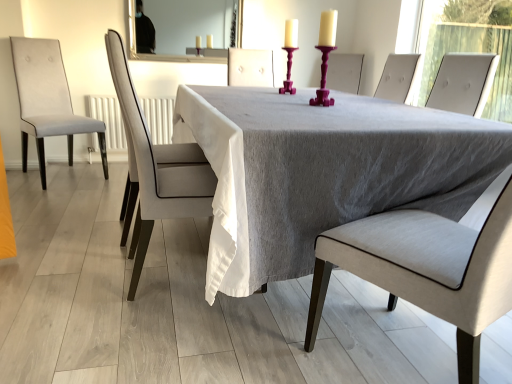
In order to face white glossy mirror at upper center, should I rotate leftwards or rightwards?

A 9.399 degree turn to the left will do.

Locate an element on the screen. The height and width of the screenshot is (384, 512). purple glossy candle holder at center, marked as the 2th candle holder in a front-to-back arrangement is located at coordinates (290, 53).

Which is behind, point (222, 44) or point (329, 27)?

The point (222, 44) is farther from the camera.

From the image's perspective, is white glossy mirror at upper center above or below purple plastic candle holder at center, the first candle holder in the front-to-back sequence?

Clearly, from the image's perspective, white glossy mirror at upper center is above purple plastic candle holder at center, the first candle holder in the front-to-back sequence.

Is white glossy mirror at upper center next to purple plastic candle holder at center, the first candle holder in the front-to-back sequence, and touching it?

No.

Which of these two, white glossy mirror at upper center or purple plastic candle holder at center, the first candle holder in the front-to-back sequence, stands shorter?

purple plastic candle holder at center, the first candle holder in the front-to-back sequence.

Consider the image. Between purple glossy candle holder at center, marked as the 2th candle holder in a front-to-back arrangement, and white glossy mirror at upper center, which one has more height?

white glossy mirror at upper center is taller.

Is purple glossy candle holder at center, the 1th candle holder positioned from the back, placed right next to white glossy mirror at upper center?

No, purple glossy candle holder at center, the 1th candle holder positioned from the back, is not touching white glossy mirror at upper center.

Choose the correct answer: Is purple glossy candle holder at center, the 1th candle holder positioned from the back, inside white glossy mirror at upper center or outside it?

purple glossy candle holder at center, the 1th candle holder positioned from the back, is not enclosed by white glossy mirror at upper center.

Is light gray fabric chair at center, which ranks as the first chair in front-to-back order, located outside purple plastic candle holder at center, the first candle holder in the front-to-back sequence?

Yes, light gray fabric chair at center, which ranks as the first chair in front-to-back order, is not within purple plastic candle holder at center, the first candle holder in the front-to-back sequence.

What's the angular difference between light gray fabric chair at center, the third chair in the back-to-front sequence, and purple plastic candle holder at center, the first candle holder in the front-to-back sequence,'s facing directions?

light gray fabric chair at center, the third chair in the back-to-front sequence, and purple plastic candle holder at center, the first candle holder in the front-to-back sequence, are facing 64.2 degrees away from each other.

Considering the sizes of objects light gray fabric chair at center, which ranks as the first chair in front-to-back order, and purple plastic candle holder at center, the first candle holder in the front-to-back sequence, in the image provided, who is bigger, light gray fabric chair at center, which ranks as the first chair in front-to-back order, or purple plastic candle holder at center, the first candle holder in the front-to-back sequence,?

light gray fabric chair at center, which ranks as the first chair in front-to-back order.

Is light gray fabric chair at center, the third chair in the back-to-front sequence, to the left or to the right of purple plastic candle holder at center, which is the second candle holder in back-to-front order, in the image?

From the image, it's evident that light gray fabric chair at center, the third chair in the back-to-front sequence, is to the right of purple plastic candle holder at center, which is the second candle holder in back-to-front order.

Considering the sizes of light gray fabric chair at left, acting as the third chair starting from the front, and light gray fabric chair at center, which is counted as the second chair, starting from the right, in the image, is light gray fabric chair at left, acting as the third chair starting from the front, bigger or smaller than light gray fabric chair at center, which is counted as the second chair, starting from the right,?

Clearly, light gray fabric chair at left, acting as the third chair starting from the front, is larger in size than light gray fabric chair at center, which is counted as the second chair, starting from the right.

Measure the distance from light gray fabric chair at left, positioned as the first chair in left-to-right order, to light gray fabric chair at center, which is counted as the second chair, starting from the right.

A distance of 1.55 meters exists between light gray fabric chair at left, positioned as the first chair in left-to-right order, and light gray fabric chair at center, which is counted as the second chair, starting from the right.

Are light gray fabric chair at left, acting as the third chair starting from the front, and light gray fabric chair at center, which is counted as the second chair, starting from the right, located far from each other?

Absolutely, light gray fabric chair at left, acting as the third chair starting from the front, is distant from light gray fabric chair at center, which is counted as the second chair, starting from the right.

Is light gray fabric chair at left, acting as the 1th chair starting from the back, in front of light gray fabric chair at center, acting as the 2th chair starting from the left?

No, light gray fabric chair at left, acting as the 1th chair starting from the back, is further to the viewer.

Considering the sizes of objects light gray fabric chair at center, acting as the 2th chair starting from the left, and purple plastic candle holder at center, the first candle holder in the front-to-back sequence, in the image provided, who is taller, light gray fabric chair at center, acting as the 2th chair starting from the left, or purple plastic candle holder at center, the first candle holder in the front-to-back sequence,?

Standing taller between the two is light gray fabric chair at center, acting as the 2th chair starting from the left.

From a real-world perspective, is light gray fabric chair at center, which is counted as the second chair, starting from the right, physically above purple plastic candle holder at center, the first candle holder in the front-to-back sequence?

Actually, light gray fabric chair at center, which is counted as the second chair, starting from the right, is physically below purple plastic candle holder at center, the first candle holder in the front-to-back sequence, in the real world.

Image resolution: width=512 pixels, height=384 pixels. In order to click on the 1st candle holder positioned above the light gray fabric chair at center, acting as the 2th chair starting from the left (from the image's perspective) in this screenshot , I will do `click(325, 55)`.

Which is more to the right, light gray fabric chair at center, acting as the 2th chair starting from the left, or purple plastic candle holder at center, which is the second candle holder in back-to-front order?

purple plastic candle holder at center, which is the second candle holder in back-to-front order.

Can you tell me how much purple plastic candle holder at center, the first candle holder in the front-to-back sequence, and light gray fabric chair at center, which ranks as the second chair in front-to-back order, differ in facing direction?

The angular difference between purple plastic candle holder at center, the first candle holder in the front-to-back sequence, and light gray fabric chair at center, which ranks as the second chair in front-to-back order, is 178 degrees.

Is purple plastic candle holder at center, which is the second candle holder in back-to-front order, thinner than light gray fabric chair at center, which ranks as the 2th chair in back-to-front order?

Correct, the width of purple plastic candle holder at center, which is the second candle holder in back-to-front order, is less than that of light gray fabric chair at center, which ranks as the 2th chair in back-to-front order.

Does purple plastic candle holder at center, which is the second candle holder in back-to-front order, have a greater height compared to light gray fabric chair at center, acting as the 2th chair starting from the left?

No, purple plastic candle holder at center, which is the second candle holder in back-to-front order, is not taller than light gray fabric chair at center, acting as the 2th chair starting from the left.

Is point (325, 82) positioned in front of point (174, 151)?

That is True.

Who is more distant, light gray fabric chair at left, the third chair positioned from the right, or gray fabric table at center?

light gray fabric chair at left, the third chair positioned from the right, is further from the camera.

From their relative heights in the image, would you say light gray fabric chair at left, the third chair positioned from the right, is taller or shorter than gray fabric table at center?

light gray fabric chair at left, the third chair positioned from the right, is taller than gray fabric table at center.

Looking at this image, is light gray fabric chair at left, acting as the 1th chair starting from the back, not near gray fabric table at center?

Yes, light gray fabric chair at left, acting as the 1th chair starting from the back, and gray fabric table at center are located far from each other.

This screenshot has height=384, width=512. Identify the location of mirror on the left of the purple plastic candle holder at center, which is the second candle holder in back-to-front order. (181, 28).

Which candle holder is the 1st one when counting from the right side of the white glossy mirror at upper center? Please provide its 2D coordinates.

[(290, 53)]

Estimate the real-world distances between objects in this image. Which object is closer to white glossy mirror at upper center, light gray fabric chair at center, positioned as the 1th chair in right-to-left order, or light gray fabric chair at left, the third chair positioned from the right?

The object closer to white glossy mirror at upper center is light gray fabric chair at left, the third chair positioned from the right.

Looking at the image, which one is located further to light gray fabric chair at center, which is counted as the second chair, starting from the right, gray fabric table at center or purple plastic candle holder at center, which is the second candle holder in back-to-front order?

purple plastic candle holder at center, which is the second candle holder in back-to-front order, is further to light gray fabric chair at center, which is counted as the second chair, starting from the right.

Estimate the real-world distances between objects in this image. Which object is closer to light gray fabric chair at center, which ranks as the 2th chair in back-to-front order, light gray fabric chair at center, which ranks as the first chair in front-to-back order, or gray fabric table at center?

gray fabric table at center is closer to light gray fabric chair at center, which ranks as the 2th chair in back-to-front order.

Considering their positions, is purple glossy candle holder at center, the 1th candle holder positioned from the back, positioned further to white glossy mirror at upper center than purple plastic candle holder at center, which is the second candle holder in back-to-front order?

purple plastic candle holder at center, which is the second candle holder in back-to-front order, is positioned further to the anchor white glossy mirror at upper center.

When comparing their distances from purple glossy candle holder at center, marked as the 2th candle holder in a front-to-back arrangement, does light gray fabric chair at center, which ranks as the second chair in front-to-back order, or white glossy mirror at upper center seem closer?

light gray fabric chair at center, which ranks as the second chair in front-to-back order, is positioned closer to the anchor purple glossy candle holder at center, marked as the 2th candle holder in a front-to-back arrangement.

Considering their positions, is light gray fabric chair at left, the third chair positioned from the right, positioned closer to light gray fabric chair at center, which is counted as the second chair, starting from the right, than purple plastic candle holder at center, which is the second candle holder in back-to-front order?

purple plastic candle holder at center, which is the second candle holder in back-to-front order, lies closer to light gray fabric chair at center, which is counted as the second chair, starting from the right, than the other object.

From the image, which object appears to be nearer to purple plastic candle holder at center, the first candle holder in the front-to-back sequence, gray fabric table at center or light gray fabric chair at center, the 3th chair from the left?

gray fabric table at center.

Which object lies nearer to the anchor point white glossy mirror at upper center, light gray fabric chair at center, acting as the 2th chair starting from the left, or light gray fabric chair at center, which ranks as the first chair in front-to-back order?

light gray fabric chair at center, acting as the 2th chair starting from the left.

This screenshot has height=384, width=512. In order to click on table located between light gray fabric chair at center, positioned as the 1th chair in right-to-left order, and light gray fabric chair at center, which ranks as the second chair in front-to-back order, in the depth direction in this screenshot , I will do `click(324, 171)`.

Find the location of a particular element. table located between light gray fabric chair at center, which ranks as the 2th chair in back-to-front order, and purple plastic candle holder at center, which is the second candle holder in back-to-front order, in the left-right direction is located at coordinates (324, 171).

This screenshot has width=512, height=384. What are the coordinates of `candle holder between light gray fabric chair at center, the third chair in the back-to-front sequence, and light gray fabric chair at center, which is counted as the second chair, starting from the right, in the front-back direction` in the screenshot? It's located at (325, 55).

Where is `table positioned between light gray fabric chair at center, the third chair in the back-to-front sequence, and purple plastic candle holder at center, the first candle holder in the front-to-back sequence, from near to far`? table positioned between light gray fabric chair at center, the third chair in the back-to-front sequence, and purple plastic candle holder at center, the first candle holder in the front-to-back sequence, from near to far is located at coordinates (324, 171).